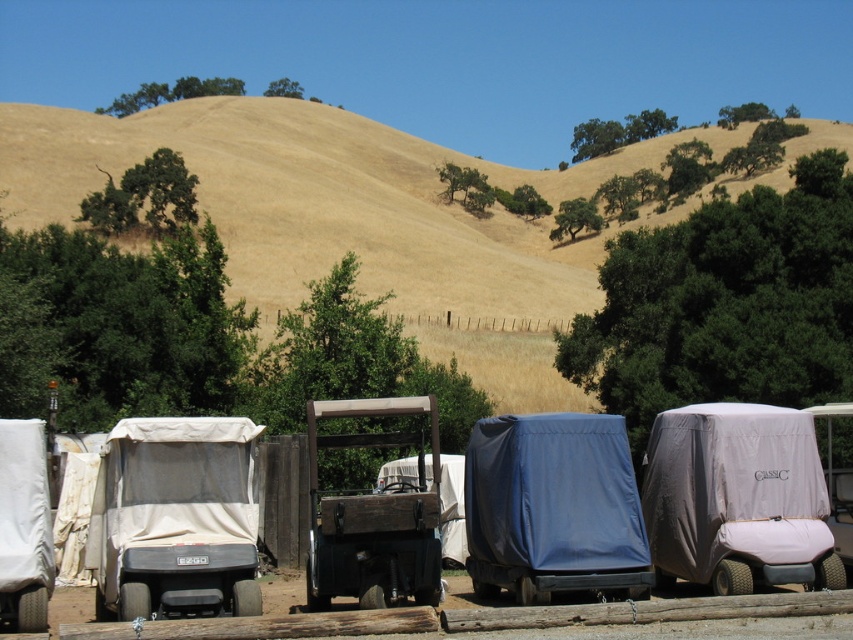
Question: Which object is farther from the camera taking this photo?

Choices:
 (A) blue tarp golf cart at center
 (B) dried grass at center
 (C) beige fabric golf cart at left
 (D) white matte golf cart at right

Answer: (B)

Question: Can you confirm if blue tarp golf cart at center is positioned above wooden golf cart at center?

Choices:
 (A) no
 (B) yes

Answer: (B)

Question: Can you confirm if dried grass at center is positioned below gray fabric golf cart at center right?

Choices:
 (A) no
 (B) yes

Answer: (A)

Question: Does beige fabric golf cart at left come in front of blue tarp golf cart at center?

Choices:
 (A) yes
 (B) no

Answer: (A)

Question: Which of the following is the closest to the observer?

Choices:
 (A) dried grass at center
 (B) beige fabric golf cart at left
 (C) wooden golf cart at center

Answer: (B)

Question: Estimate the real-world distances between objects in this image. Which object is closer to the gray fabric golf cart at center right?

Choices:
 (A) dried grass at center
 (B) beige fabric golf cart at left

Answer: (B)